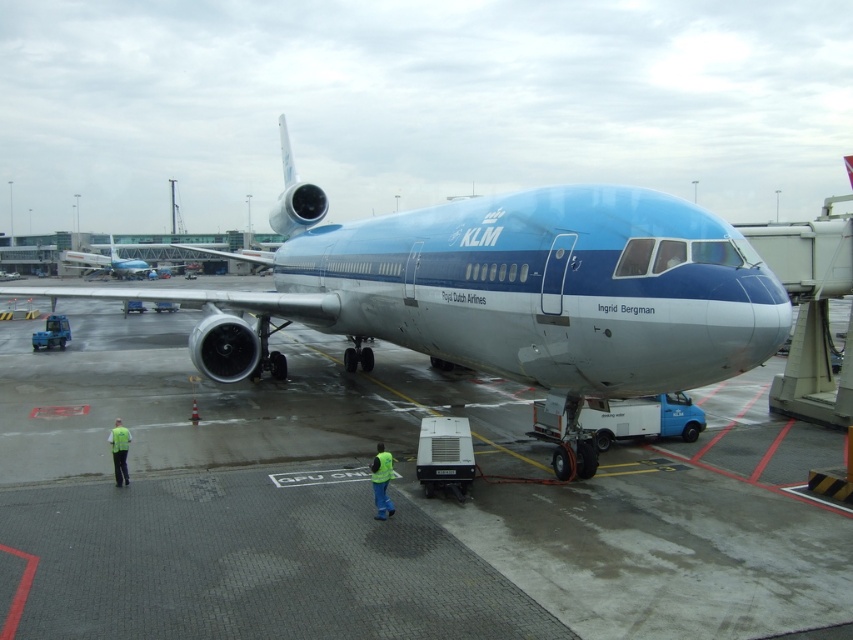
Question: Which point is farther to the camera?

Choices:
 (A) (607, 396)
 (B) (125, 461)

Answer: (B)

Question: Can you confirm if concrete tarmac at center is positioned above yellow reflective vest at lower center?

Choices:
 (A) no
 (B) yes

Answer: (B)

Question: Among these points, which one is nearest to the camera?

Choices:
 (A) (387, 467)
 (B) (416, 224)
 (C) (657, 461)
 (D) (109, 264)

Answer: (A)

Question: Is concrete tarmac at center to the right of yellow reflective vest at lower left from the viewer's perspective?

Choices:
 (A) no
 (B) yes

Answer: (B)

Question: Based on their relative distances, which object is nearer to the yellow reflective vest at lower left?

Choices:
 (A) metallic blue airplane at center
 (B) concrete tarmac at center
 (C) yellow reflective vest at lower center
 (D) blue metallic airplane at center

Answer: (C)

Question: Considering the relative positions of concrete tarmac at center and yellow reflective vest at lower left in the image provided, where is concrete tarmac at center located with respect to yellow reflective vest at lower left?

Choices:
 (A) below
 (B) above

Answer: (B)